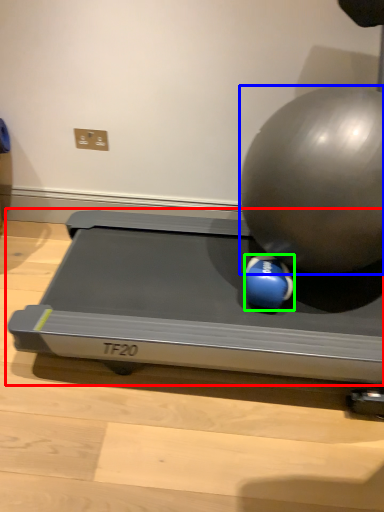
Question: Considering the real-world distances, which object is closest to treadmill (highlighted by a red box)? ball (highlighted by a blue box) or ball (highlighted by a green box).

Choices:
 (A) ball
 (B) ball

Answer: (B)